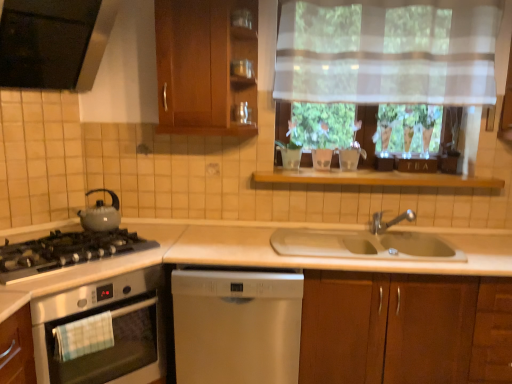
What do you see at coordinates (204, 66) in the screenshot? I see `wooden cabinet at upper center, placed as the 1th cabinetry when sorted from top to bottom` at bounding box center [204, 66].

You are a GUI agent. You are given a task and a screenshot of the screen. Output one action in this format:
    pyautogui.click(x=<x>, y=<y>)
    Task: Click on the wooden cabinet at lower right, which is counted as the 1th cabinetry, starting from the right
    This screenshot has height=384, width=512.
    Given the screenshot: What is the action you would take?
    pyautogui.click(x=394, y=327)

What do you see at coordinates (66, 251) in the screenshot?
I see `matte gray gas stove at left` at bounding box center [66, 251].

The height and width of the screenshot is (384, 512). I want to click on matte gray kettle at left, which appears as the 2th kitchen appliance when ordered from the bottom, so click(x=100, y=213).

From the image's perspective, who appears lower, satin white dishwasher at center or translucent fabric at upper center?

satin white dishwasher at center, from the image's perspective.

Is translucent fabric at upper center at the back of satin white dishwasher at center?

satin white dishwasher at center is not turned away from translucent fabric at upper center.

Is satin white dishwasher at center wider than translucent fabric at upper center?

Yes, satin white dishwasher at center is wider than translucent fabric at upper center.

In the scene shown: Who is bigger, satin white dishwasher at center or translucent fabric at upper center?

With larger size is satin white dishwasher at center.

From a real-world perspective, is wooden cabinet at upper center, which is the second cabinetry in bottom-to-top order, over matte gray kettle at left, which appears as the 2th kitchen appliance when ordered from the bottom?

Yes, from a real-world perspective, wooden cabinet at upper center, which is the second cabinetry in bottom-to-top order, is over matte gray kettle at left, which appears as the 2th kitchen appliance when ordered from the bottom

Between point (223, 4) and point (88, 218), which one is positioned behind?

The point (88, 218) is farther.

How much distance is there between wooden cabinet at upper center, which is the second cabinetry in bottom-to-top order, and matte gray kettle at left, positioned as the 1th kitchen appliance in top-to-bottom order?

wooden cabinet at upper center, which is the second cabinetry in bottom-to-top order, and matte gray kettle at left, positioned as the 1th kitchen appliance in top-to-bottom order, are 33.48 inches apart from each other.

From the image's perspective, is wooden cabinet at upper center, acting as the second cabinetry starting from the right, over matte gray kettle at left, which appears as the 2th kitchen appliance when ordered from the bottom?

Correct, wooden cabinet at upper center, acting as the second cabinetry starting from the right, appears higher than matte gray kettle at left, which appears as the 2th kitchen appliance when ordered from the bottom, in the image.

Which is in front, point (250, 310) or point (157, 354)?

The point (250, 310) is in front.

From a real-world perspective, is satin white dishwasher at center located higher than stainless steel oven at left, which is counted as the second kitchen appliance, starting from the top?

Actually, satin white dishwasher at center is physically below stainless steel oven at left, which is counted as the second kitchen appliance, starting from the top, in the real world.

Does satin white dishwasher at center have a lesser width compared to stainless steel oven at left, which is counted as the second kitchen appliance, starting from the top?

Incorrect, the width of satin white dishwasher at center is not less than that of stainless steel oven at left, which is counted as the second kitchen appliance, starting from the top.

Does satin white dishwasher at center come behind stainless steel oven at left, the first kitchen appliance in the bottom-to-top sequence?

Yes, satin white dishwasher at center is further from the camera.

Is matte gray kettle at left, positioned as the 1th kitchen appliance in top-to-bottom order, next to wooden cabinet at upper center, placed as the 1th cabinetry when sorted from top to bottom, and touching it?

No, matte gray kettle at left, positioned as the 1th kitchen appliance in top-to-bottom order, is not next to wooden cabinet at upper center, placed as the 1th cabinetry when sorted from top to bottom.

Locate an element on the screen. cabinetry above the matte gray kettle at left, which appears as the 2th kitchen appliance when ordered from the bottom (from a real-world perspective) is located at coordinates (204, 66).

Between matte gray kettle at left, positioned as the 1th kitchen appliance in top-to-bottom order, and wooden cabinet at upper center, placed as the 1th cabinetry when sorted from top to bottom, which one has more height?

wooden cabinet at upper center, placed as the 1th cabinetry when sorted from top to bottom, is taller.

From a real-world perspective, is matte gray kettle at left, positioned as the 1th kitchen appliance in top-to-bottom order, physically located above or below wooden cabinet at upper center, acting as the second cabinetry starting from the right?

matte gray kettle at left, positioned as the 1th kitchen appliance in top-to-bottom order, is situated lower than wooden cabinet at upper center, acting as the second cabinetry starting from the right, in the real world.

Which object is positioned more to the right, wooden shelf at center or satin white dishwasher at center?

Result: wooden shelf at center is more to the right.

In the scene shown: Is wooden shelf at center facing towards satin white dishwasher at center?

No.

Looking at this image, considering the sizes of wooden shelf at center and satin white dishwasher at center in the image, is wooden shelf at center wider or thinner than satin white dishwasher at center?

In the image, wooden shelf at center appears to be more narrow than satin white dishwasher at center.

Looking at the image, does wooden shelf at center seem bigger or smaller compared to satin white dishwasher at center?

wooden shelf at center is smaller than satin white dishwasher at center.

Is wooden shelf at center not close to stainless steel oven at left, which is counted as the second kitchen appliance, starting from the top?

Absolutely, wooden shelf at center is distant from stainless steel oven at left, which is counted as the second kitchen appliance, starting from the top.

Is wooden shelf at center smaller than stainless steel oven at left, the first kitchen appliance in the bottom-to-top sequence?

Yes.

How different are the orientations of wooden shelf at center and stainless steel oven at left, which is counted as the second kitchen appliance, starting from the top, in degrees?

The facing directions of wooden shelf at center and stainless steel oven at left, which is counted as the second kitchen appliance, starting from the top, are 50.2 degrees apart.

From a real-world perspective, is wooden shelf at center located higher than stainless steel oven at left, which is counted as the second kitchen appliance, starting from the top?

Correct, in the physical world, wooden shelf at center is higher than stainless steel oven at left, which is counted as the second kitchen appliance, starting from the top.

Is point (357, 302) closer to camera compared to point (339, 175)?

Yes, point (357, 302) is closer to viewer.

Is wooden cabinet at lower right, the second cabinetry when ordered from top to bottom, bigger than wooden shelf at center?

Yes.

Can you see wooden cabinet at lower right, the second cabinetry when ordered from top to bottom, touching wooden shelf at center?

There is a gap between wooden cabinet at lower right, the second cabinetry when ordered from top to bottom, and wooden shelf at center.

Identify the location of window sill above the wooden cabinet at lower right, arranged as the 2th cabinetry when viewed from the left (from a real-world perspective). Image resolution: width=512 pixels, height=384 pixels. (374, 178).

What are the coordinates of `dishwasher on the left side of translucent fabric at upper center` in the screenshot? It's located at (236, 324).

Locate an element on the screen. the 1st cabinetry in front of the matte gray kettle at left, positioned as the 1th kitchen appliance in top-to-bottom order is located at coordinates pos(204,66).

Which object lies further to the anchor point stainless steel oven at left, which is counted as the second kitchen appliance, starting from the top, satin white dishwasher at center or matte glass jar at upper center?

matte glass jar at upper center lies further to stainless steel oven at left, which is counted as the second kitchen appliance, starting from the top, than the other object.

Estimate the real-world distances between objects in this image. Which object is further from wooden shelf at center, matte gray kettle at left, positioned as the 1th kitchen appliance in top-to-bottom order, or stainless steel oven at left, the first kitchen appliance in the bottom-to-top sequence?

Among the two, stainless steel oven at left, the first kitchen appliance in the bottom-to-top sequence, is located further to wooden shelf at center.

From the picture: From the image, which object appears to be farther from matte gray gas stove at left, satin white dishwasher at center or translucent fabric at upper center?

translucent fabric at upper center is further to matte gray gas stove at left.

Based on their spatial positions, is wooden cabinet at lower right, arranged as the 2th cabinetry when viewed from the left, or translucent fabric at upper center further from satin white dishwasher at center?

translucent fabric at upper center lies further to satin white dishwasher at center than the other object.

From the image, which object appears to be farther from stainless steel oven at left, the first kitchen appliance in the bottom-to-top sequence, wooden shelf at center or wooden cabinet at upper center, which is the second cabinetry in bottom-to-top order?

wooden shelf at center is further to stainless steel oven at left, the first kitchen appliance in the bottom-to-top sequence.

Which object lies nearer to the anchor point satin white dishwasher at center, stainless steel oven at left, the first kitchen appliance in the bottom-to-top sequence, or matte gray kettle at left, positioned as the 1th kitchen appliance in top-to-bottom order?

Based on the image, stainless steel oven at left, the first kitchen appliance in the bottom-to-top sequence, appears to be nearer to satin white dishwasher at center.

Considering their positions, is matte gray gas stove at left positioned further to wooden cabinet at lower right, which is counted as the 1th cabinetry, starting from the right, than satin white dishwasher at center?

Among the two, matte gray gas stove at left is located further to wooden cabinet at lower right, which is counted as the 1th cabinetry, starting from the right.

From the picture: Estimate the real-world distances between objects in this image. Which object is closer to translucent fabric at upper center, wooden cabinet at lower right, the first cabinetry when ordered from bottom to top, or stainless steel oven at left, the first kitchen appliance in the bottom-to-top sequence?

wooden cabinet at lower right, the first cabinetry when ordered from bottom to top, is positioned closer to the anchor translucent fabric at upper center.

Identify the location of kitchen appliance between matte gray kettle at left, positioned as the 1th kitchen appliance in top-to-bottom order, and wooden cabinet at lower right, arranged as the 2th cabinetry when viewed from the left, from left to right. (113, 330).

Where is `window sill between matte gray kettle at left, positioned as the 1th kitchen appliance in top-to-bottom order, and translucent fabric at upper center`? window sill between matte gray kettle at left, positioned as the 1th kitchen appliance in top-to-bottom order, and translucent fabric at upper center is located at coordinates (374, 178).

This screenshot has width=512, height=384. What are the coordinates of `window situated between matte gray kettle at left, positioned as the 1th kitchen appliance in top-to-bottom order, and wooden cabinet at lower right, the first cabinetry when ordered from bottom to top, from left to right` in the screenshot? It's located at (266, 85).

Image resolution: width=512 pixels, height=384 pixels. What are the coordinates of `window sill between stainless steel oven at left, which is counted as the second kitchen appliance, starting from the top, and translucent fabric at upper center, in the horizontal direction` in the screenshot? It's located at (374, 178).